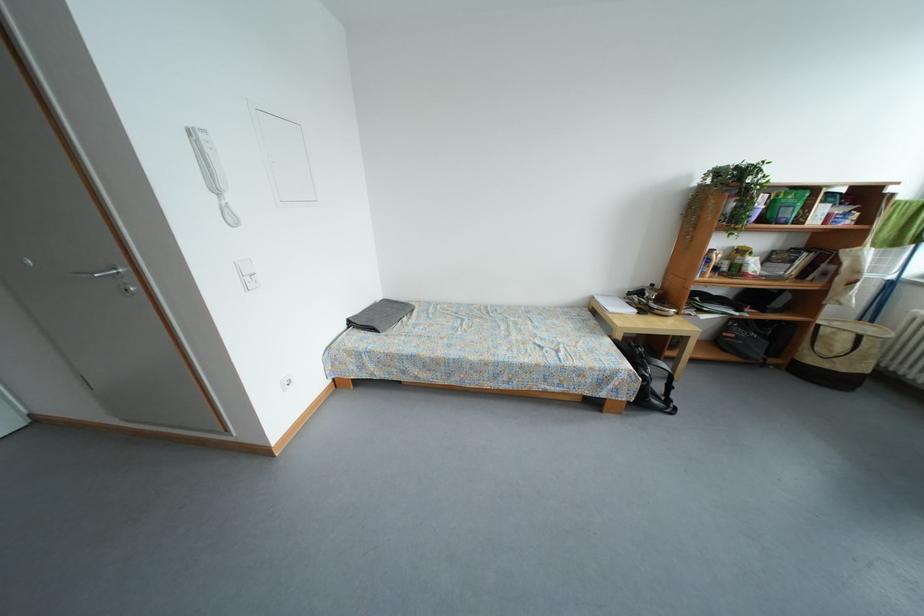
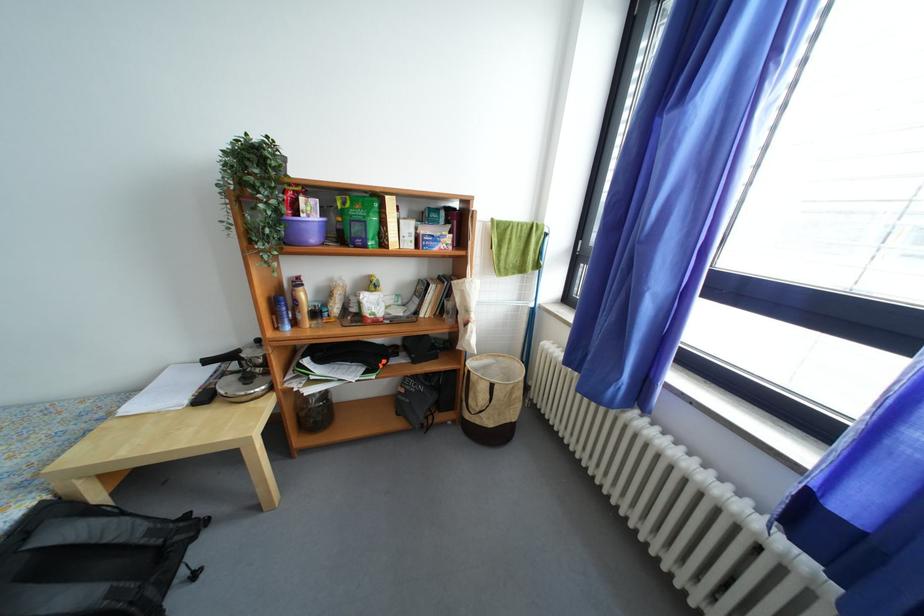
Where in the second image is the point corresponding to point (760, 224) from the first image?

(320, 243)